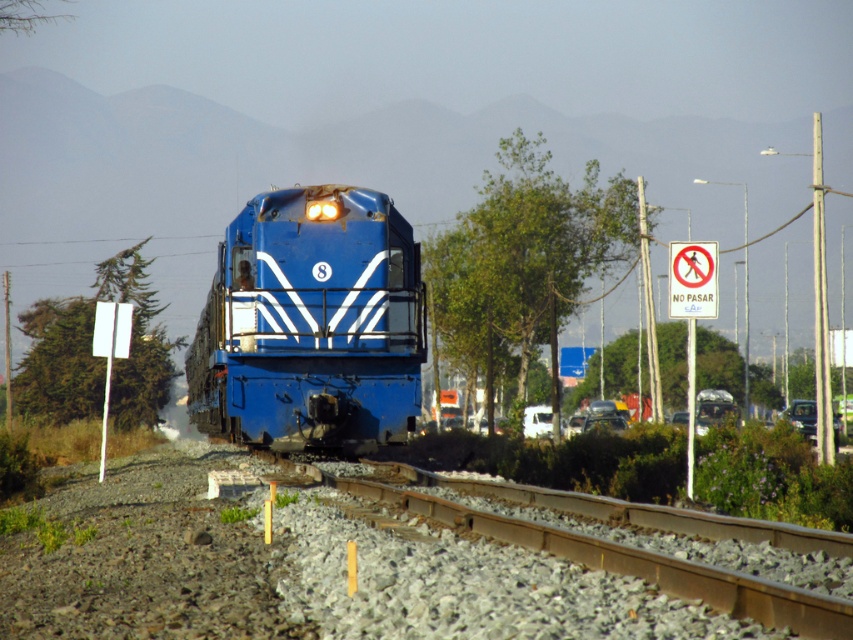
Question: Does blue glossy locomotive at center appear on the right side of rusty metal train track at center?

Choices:
 (A) no
 (B) yes

Answer: (A)

Question: Which point is farther to the camera?

Choices:
 (A) white matte van at center
 (B) rusty metal train track at center

Answer: (A)

Question: Can you confirm if rusty metal train track at center is bigger than white matte van at center?

Choices:
 (A) no
 (B) yes

Answer: (A)

Question: Estimate the real-world distances between objects in this image. Which object is closer to the white matte van at center?

Choices:
 (A) blue glossy locomotive at center
 (B) rusty metal train track at center

Answer: (A)

Question: Which point is farther to the camera?

Choices:
 (A) blue glossy locomotive at center
 (B) white matte van at center
 (C) rusty metal train track at center

Answer: (B)

Question: In this image, where is blue glossy locomotive at center located relative to rusty metal train track at center?

Choices:
 (A) left
 (B) right

Answer: (A)